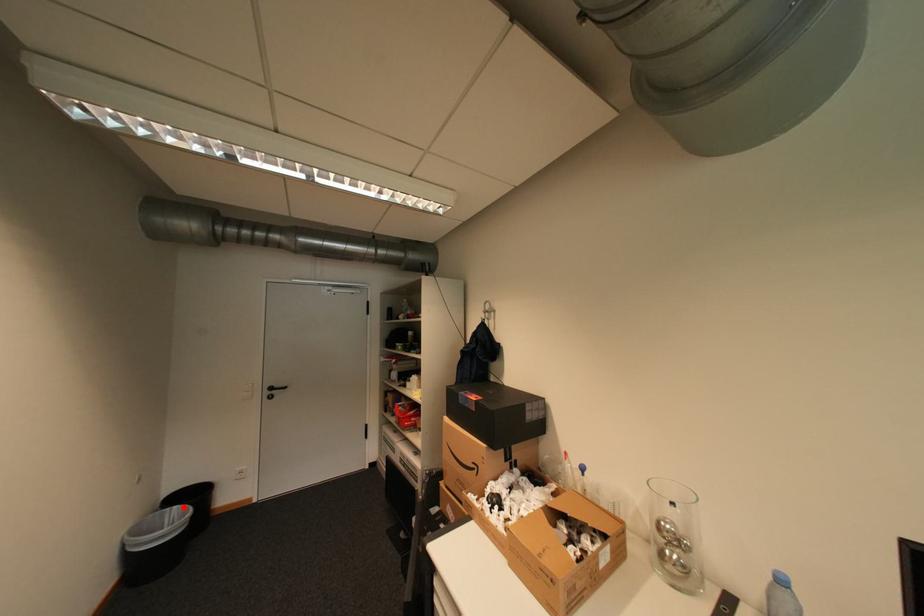
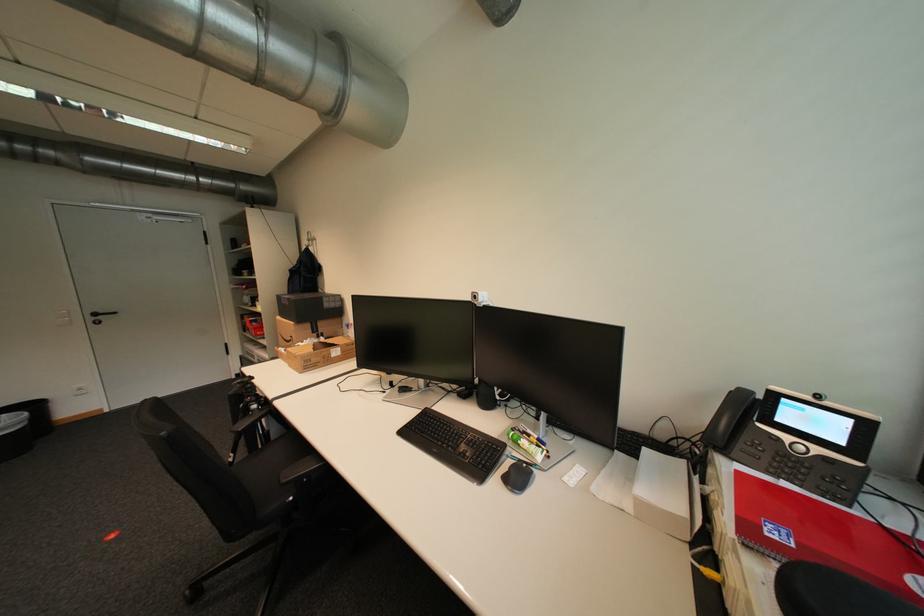
Question: I am providing you with two images of the same scene from different viewpoints. Given a red point in image1, look at the same physical point in image2. Is it:

Choices:
 (A) Closer to the viewpoint
 (B) Farther from the viewpoint

Answer: (B)